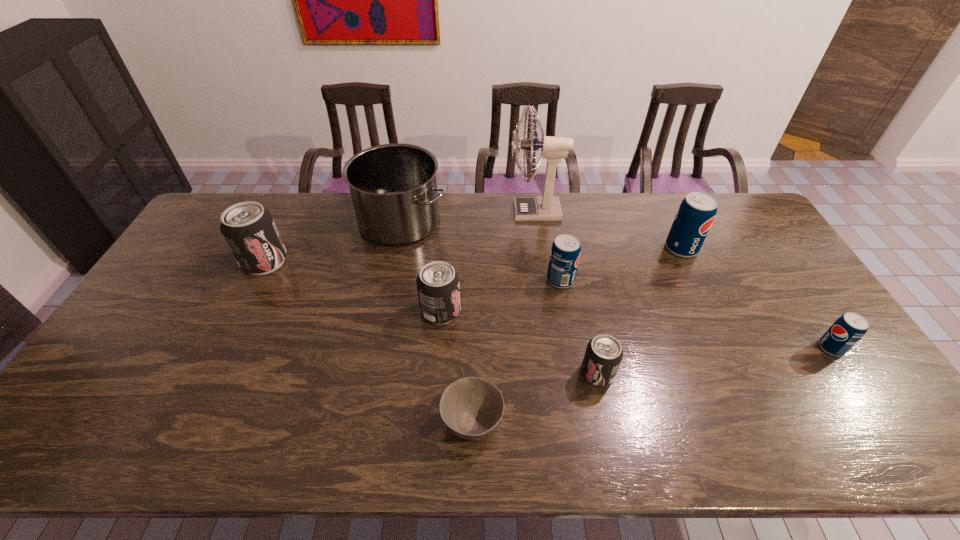
This screenshot has width=960, height=540. What are the coordinates of `object positioned at the near edge` in the screenshot? It's located at (471, 408).

Where is `object at the right edge`? object at the right edge is located at coordinates (848, 329).

Locate an element on the screen. Image resolution: width=960 pixels, height=540 pixels. vacant position at the far edge of the desktop is located at coordinates (324, 193).

Image resolution: width=960 pixels, height=540 pixels. Identify the location of vacant space at the near edge of the desktop. (360, 455).

Identify the location of free space at the left edge of the desktop. (209, 274).

Identify the location of vacant space at the right edge of the desktop. (803, 331).

What are the coordinates of `unoccupied area between the rightmost black soda can and the second blue pop from left to right` in the screenshot? It's located at (639, 310).

The height and width of the screenshot is (540, 960). Find the location of `vacant space that's between the farthest black soda can and the farthest blue pop`. vacant space that's between the farthest black soda can and the farthest blue pop is located at coordinates (473, 255).

Find the location of `vacant area that lies between the shortest object and the biggest black soda can`. vacant area that lies between the shortest object and the biggest black soda can is located at coordinates (369, 342).

This screenshot has width=960, height=540. Find the location of `free spot between the second nearest blue pop and the fan`. free spot between the second nearest blue pop and the fan is located at coordinates (548, 246).